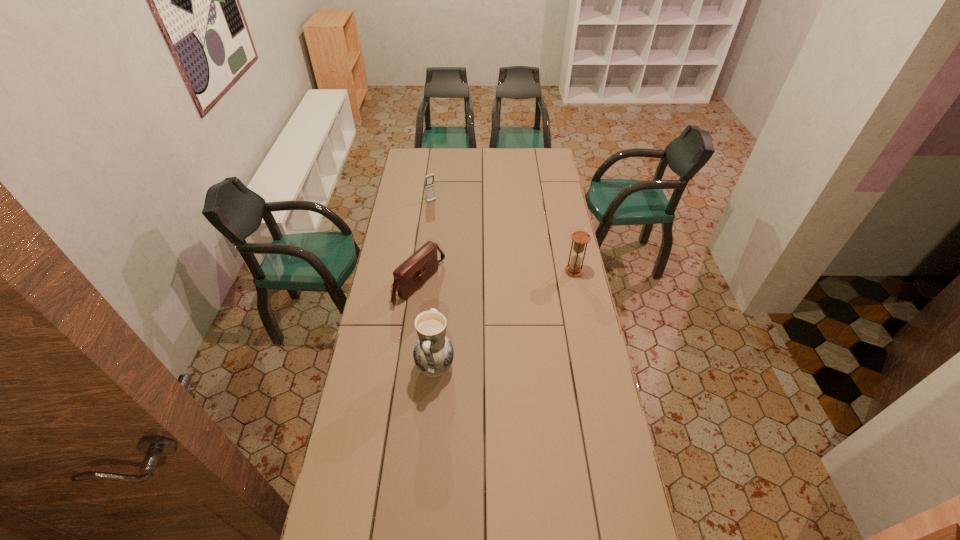
Where is `vacant space on the desktop that is between the pottery and the second tallest object and is positioned on the front flap of the shoulder bag`? This screenshot has width=960, height=540. vacant space on the desktop that is between the pottery and the second tallest object and is positioned on the front flap of the shoulder bag is located at coordinates (497, 324).

Find the location of a particular element. vacant space on the desktop that is between the tallest object and the third shortest object and is positioned on the front-facing side of the farthest object is located at coordinates (522, 307).